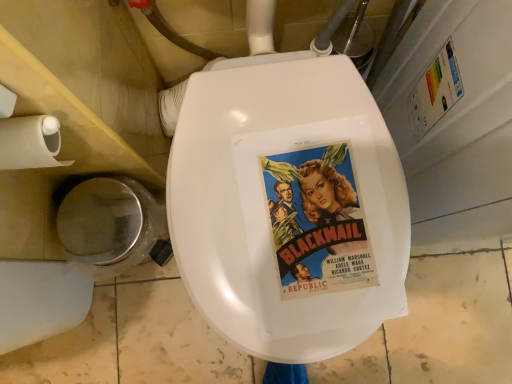
Question: Is beige paper towel at left to the right of shiny metallic trash can at lower left from the viewer's perspective?

Choices:
 (A) yes
 (B) no

Answer: (A)

Question: Is beige paper towel at left to the left of shiny metallic trash can at lower left from the viewer's perspective?

Choices:
 (A) no
 (B) yes

Answer: (A)

Question: From a real-world perspective, does beige paper towel at left sit lower than shiny metallic trash can at lower left?

Choices:
 (A) yes
 (B) no

Answer: (B)

Question: Is beige paper towel at left far from shiny metallic trash can at lower left?

Choices:
 (A) yes
 (B) no

Answer: (B)

Question: Does beige paper towel at left lie in front of shiny metallic trash can at lower left?

Choices:
 (A) no
 (B) yes

Answer: (B)

Question: Visually, is vivid paper poster at center positioned to the left or to the right of beige paper towel at left?

Choices:
 (A) left
 (B) right

Answer: (B)

Question: Is vivid paper poster at center bigger or smaller than beige paper towel at left?

Choices:
 (A) big
 (B) small

Answer: (B)

Question: Is vivid paper poster at center wider or thinner than beige paper towel at left?

Choices:
 (A) thin
 (B) wide

Answer: (B)

Question: From their relative heights in the image, would you say vivid paper poster at center is taller or shorter than beige paper towel at left?

Choices:
 (A) short
 (B) tall

Answer: (A)

Question: Is shiny metallic trash can at lower left inside the boundaries of vivid paper poster at center, or outside?

Choices:
 (A) outside
 (B) inside

Answer: (A)

Question: Is shiny metallic trash can at lower left to the left or to the right of vivid paper poster at center in the image?

Choices:
 (A) right
 (B) left

Answer: (B)

Question: From their relative heights in the image, would you say shiny metallic trash can at lower left is taller or shorter than vivid paper poster at center?

Choices:
 (A) short
 (B) tall

Answer: (B)

Question: Looking at their shapes, would you say shiny metallic trash can at lower left is wider or thinner than vivid paper poster at center?

Choices:
 (A) wide
 (B) thin

Answer: (B)

Question: Is vivid paper poster at center inside or outside of shiny metallic trash can at lower left?

Choices:
 (A) inside
 (B) outside

Answer: (B)

Question: Looking at the image, does vivid paper poster at center seem bigger or smaller compared to shiny metallic trash can at lower left?

Choices:
 (A) big
 (B) small

Answer: (B)